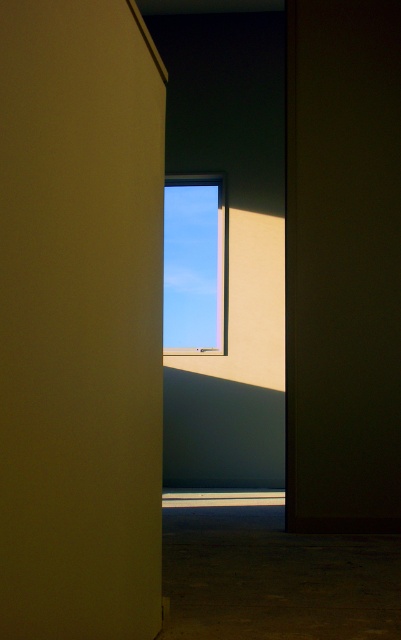
Question: Which point appears farthest from the camera in this image?

Choices:
 (A) (16, 592)
 (B) (196, 273)

Answer: (B)

Question: Which object appears farthest from the camera in this image?

Choices:
 (A) transparent glass window at center
 (B) matte yellow door at center

Answer: (A)

Question: Is matte yellow door at center wider than transparent glass window at center?

Choices:
 (A) yes
 (B) no

Answer: (B)

Question: Does matte yellow door at center have a smaller size compared to transparent glass window at center?

Choices:
 (A) no
 (B) yes

Answer: (B)

Question: Is matte yellow door at center bigger than transparent glass window at center?

Choices:
 (A) yes
 (B) no

Answer: (B)

Question: Which point is closer to the camera?

Choices:
 (A) [x=85, y=438]
 (B) [x=218, y=266]

Answer: (A)